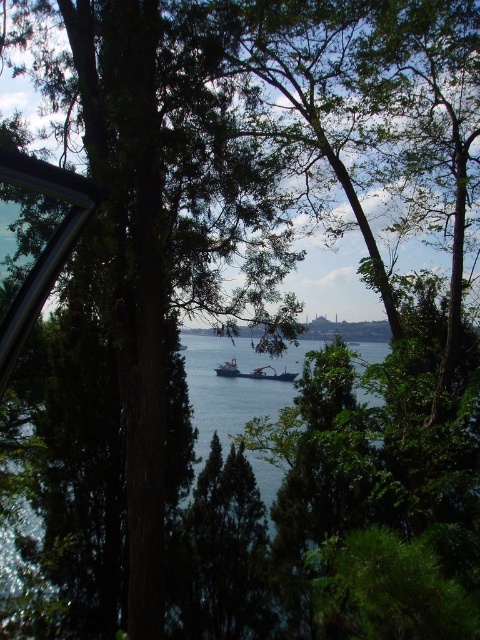
Consider the image. You are standing at the center of the image and want to locate the metallic blue ship at center. What are the coordinates where you should look?

The metallic blue ship at center is located at coordinates point (252, 372).

You are a sailor on a boat and you see two ships in the distance, the metallic blue ship at center and the metallic gray ship at center. Which ship is located to the right when looking at the scene?

The metallic blue ship at center is positioned on the right side of the metallic gray ship at center, so it is located to the right.

You are an observer standing on the shore looking at the two ships in the water. Which ship, the metallic blue ship at center or the metallic gray ship at center, appears closer to you?

The metallic blue ship at center appears closer because it is positioned below the metallic gray ship at center, indicating it is lower in the frame and thus nearer to the observer.